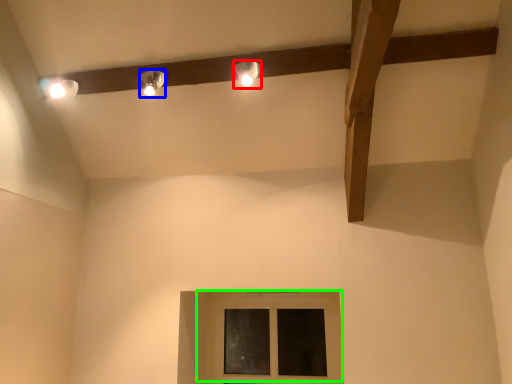
Question: Estimate the real-world distances between objects in this image. Which object is closer to lamp (highlighted by a red box), lamp (highlighted by a blue box) or window (highlighted by a green box)?

Choices:
 (A) lamp
 (B) window

Answer: (A)